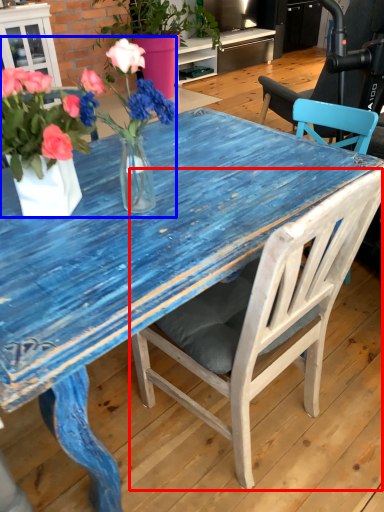
Question: Which object is further to the camera taking this photo, chair (highlighted by a red box) or floral arrangement (highlighted by a blue box)?

Choices:
 (A) chair
 (B) floral arrangement

Answer: (B)